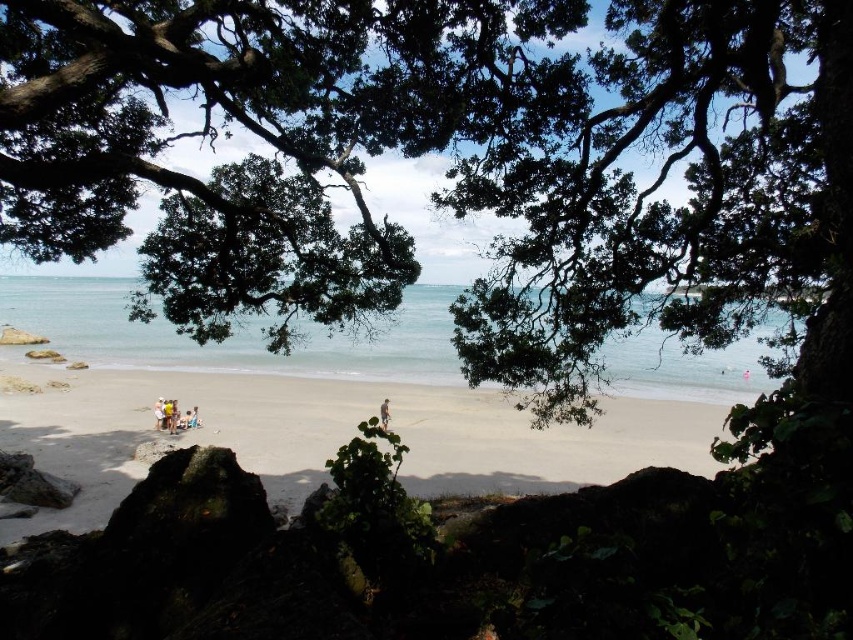
Question: From the image, what is the correct spatial relationship of green leafy tree at center in relation to light brown wooden chair at lower left?

Choices:
 (A) right
 (B) left

Answer: (A)

Question: Which object is closer to the camera taking this photo?

Choices:
 (A) light brown wooden chair at center
 (B) light brown wooden chair at lower left

Answer: (B)

Question: Which object is closer to the camera taking this photo?

Choices:
 (A) light brown sand at center
 (B) green leafy tree at center
 (C) light brown wooden chair at center
 (D) clear blue water at center

Answer: (B)

Question: Is green leafy tree at center smaller than clear blue water at center?

Choices:
 (A) yes
 (B) no

Answer: (A)

Question: Does light brown sand at center appear on the left side of light brown wooden surfboard at center?

Choices:
 (A) yes
 (B) no

Answer: (A)

Question: Estimate the real-world distances between objects in this image. Which object is farther from the light brown wooden chair at center?

Choices:
 (A) light brown sand at center
 (B) clear blue water at center

Answer: (B)